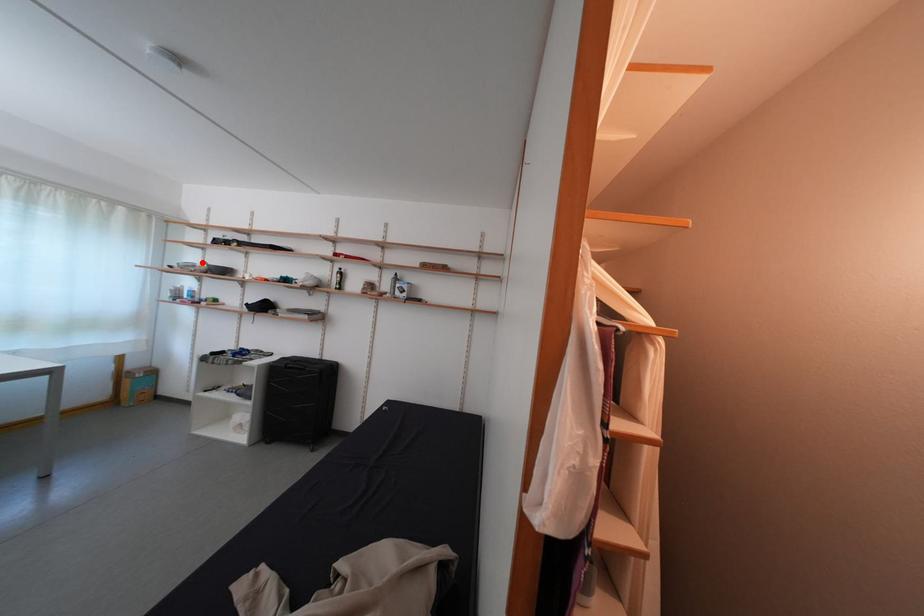
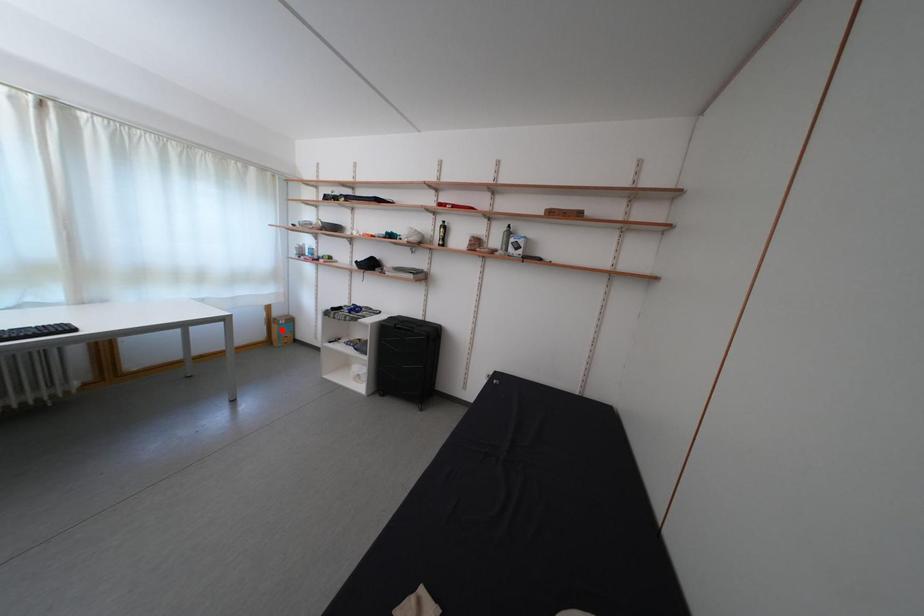
I am providing you with two images of the same scene from different viewpoints. A red point is marked on the first image and another point is marked on the second image. Is the marked point in image1 the same physical position as the marked point in image2?

No